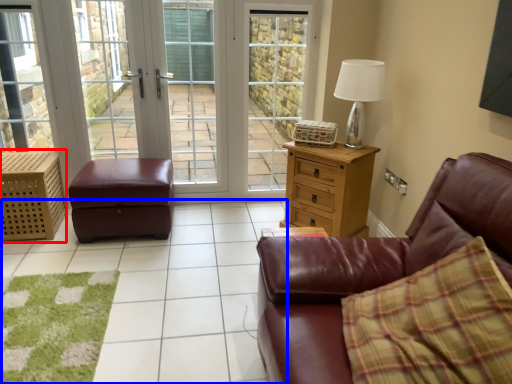
Question: Among these objects, which one is nearest to the camera, dresser (highlighted by a red box) or tile (highlighted by a blue box)?

Choices:
 (A) dresser
 (B) tile

Answer: (B)